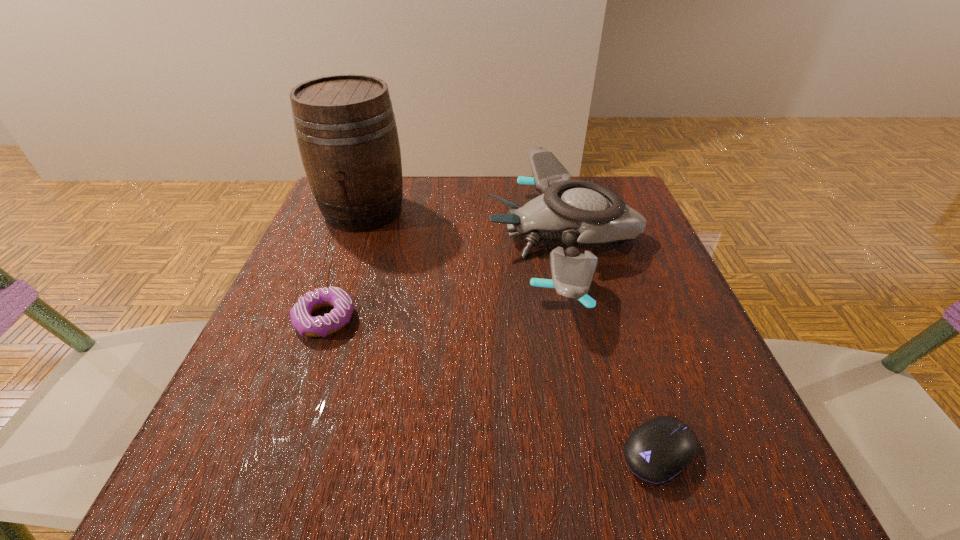
At what (x,y) coordinates should I click in order to perform the action: click on vacant region between the drone and the doughnut. Please return your answer as a coordinate pair (x, y). The image size is (960, 540). Looking at the image, I should click on (444, 279).

Where is `free spot between the cider and the doughnut`? free spot between the cider and the doughnut is located at coordinates (344, 265).

Locate an element on the screen. This screenshot has width=960, height=540. vacant space in between the computer mouse and the drone is located at coordinates click(x=612, y=346).

Locate an element on the screen. vacant space that's between the third shortest object and the nearest object is located at coordinates click(612, 346).

Identify the location of free space between the tallest object and the doughnut. This screenshot has width=960, height=540. (344, 265).

At what (x,y) coordinates should I click in order to perform the action: click on free area in between the doughnut and the computer mouse. Please return your answer as a coordinate pair (x, y). Image resolution: width=960 pixels, height=540 pixels. Looking at the image, I should click on (492, 386).

Where is `free space that is in between the second tallest object and the doughnut`? free space that is in between the second tallest object and the doughnut is located at coordinates (444, 279).

Identify which object is located as the nearest to the doughnut. Please provide its 2D coordinates. Your answer should be formatted as a tuple, i.e. [(x, y)], where the tuple contains the x and y coordinates of a point satisfying the conditions above.

[(346, 130)]

At what (x,y) coordinates should I click in order to perform the action: click on object that is the nearest to the doughnut. Please return your answer as a coordinate pair (x, y). This screenshot has height=540, width=960. Looking at the image, I should click on (346, 130).

This screenshot has height=540, width=960. Find the location of `free space that satisfies the following two spatial constraints: 1. on the side of the computer mouse near the bung hole; 2. on the left side of the cider`. free space that satisfies the following two spatial constraints: 1. on the side of the computer mouse near the bung hole; 2. on the left side of the cider is located at coordinates (276, 453).